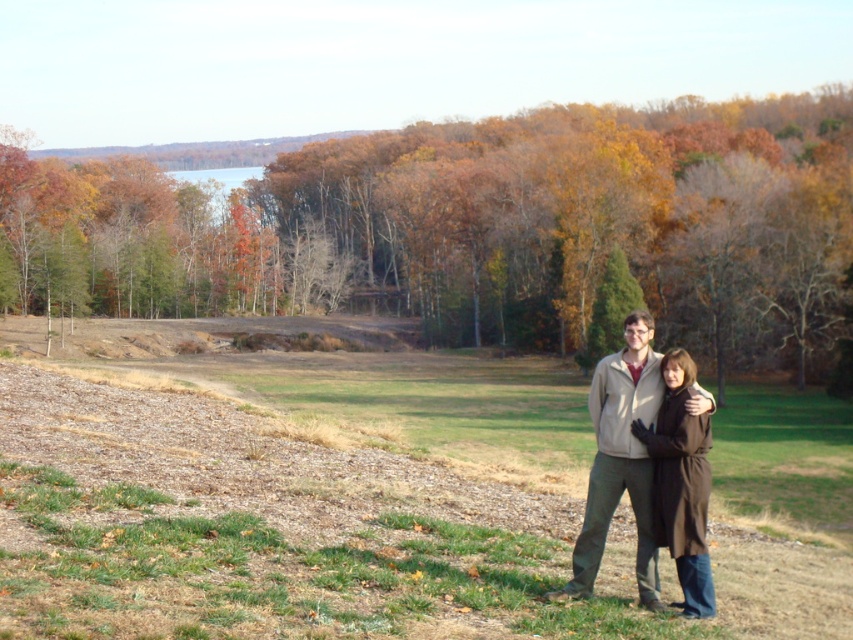
Question: Considering the real-world distances, which object is farthest from the beige fleece jacket at center?

Choices:
 (A) brown wool coat at lower right
 (B) brown matte tree at center

Answer: (B)

Question: Estimate the real-world distances between objects in this image. Which object is closer to the brown wool coat at lower right?

Choices:
 (A) beige fleece jacket at center
 (B) brown matte tree at center

Answer: (A)

Question: Where is brown matte tree at center located in relation to brown wool coat at lower right in the image?

Choices:
 (A) above
 (B) below

Answer: (A)

Question: Observing the image, what is the correct spatial positioning of brown matte tree at center in reference to beige fleece jacket at center?

Choices:
 (A) right
 (B) left

Answer: (B)

Question: Which object is positioned farthest from the beige fleece jacket at center?

Choices:
 (A) brown wool coat at lower right
 (B) brown matte tree at center

Answer: (B)

Question: Does brown matte tree at center appear on the right side of brown wool coat at lower right?

Choices:
 (A) no
 (B) yes

Answer: (A)